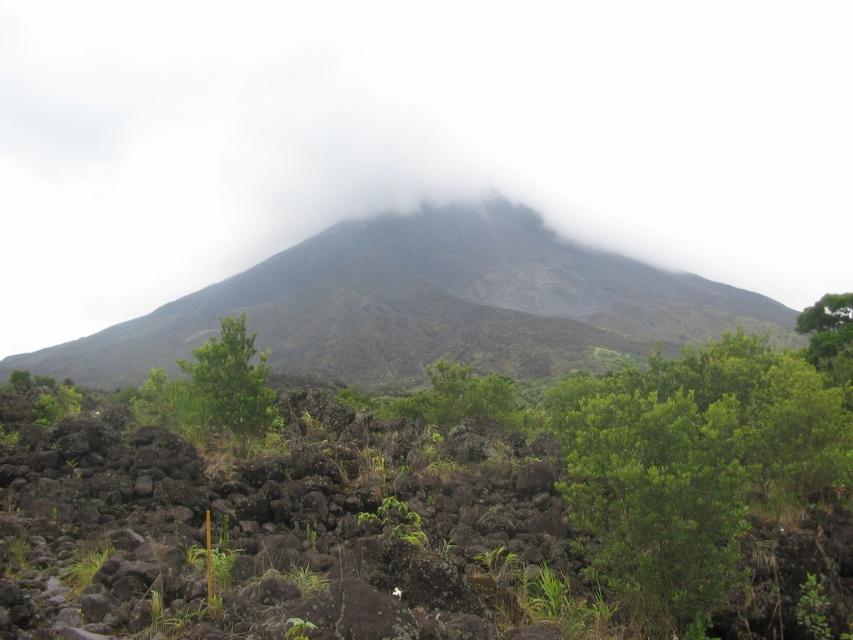
Question: Which point is farther to the camera?

Choices:
 (A) green leafy bush at center
 (B) green leafy tree at upper right
 (C) green leafy tree at center

Answer: (C)

Question: Among these objects, which one is farthest from the camera?

Choices:
 (A) green leafy tree at center
 (B) green leafy bush at center
 (C) dark gray rocky mountain at center
 (D) green leafy tree at upper right

Answer: (C)

Question: Which of these objects is positioned farthest from the green leafy tree at center?

Choices:
 (A) green leafy tree at upper right
 (B) dark gray rocky mountain at center

Answer: (B)

Question: Can you confirm if dark gray rocky mountain at center is wider than green leafy bush at center?

Choices:
 (A) yes
 (B) no

Answer: (A)

Question: Is green leafy tree at center positioned in front of green leafy tree at upper right?

Choices:
 (A) no
 (B) yes

Answer: (A)

Question: In this image, where is dark gray rocky mountain at center located relative to green leafy tree at upper right?

Choices:
 (A) right
 (B) left

Answer: (B)